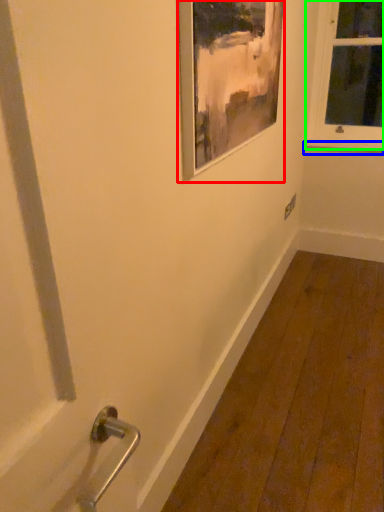
Question: Which object is the farthest from picture frame (highlighted by a red box)? Choose among these: window sill (highlighted by a blue box) or window (highlighted by a green box).

Choices:
 (A) window sill
 (B) window

Answer: (A)